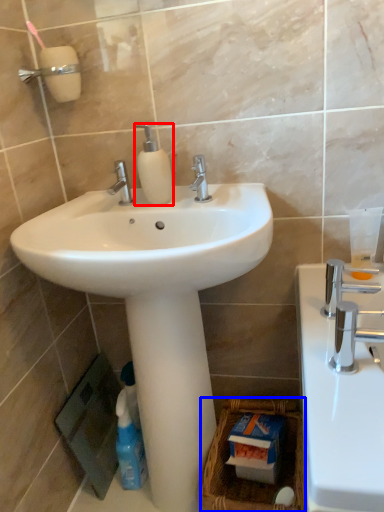
Question: Among these objects, which one is nearest to the camera, soap dispenser (highlighted by a red box) or basket (highlighted by a blue box)?

Choices:
 (A) soap dispenser
 (B) basket

Answer: (B)